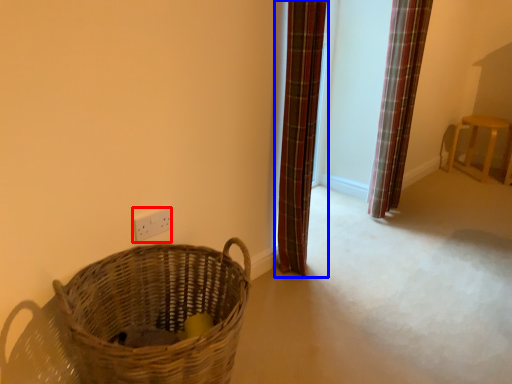
Question: Among these objects, which one is nearest to the camera, electric outlet (highlighted by a red box) or curtain (highlighted by a blue box)?

Choices:
 (A) electric outlet
 (B) curtain

Answer: (A)